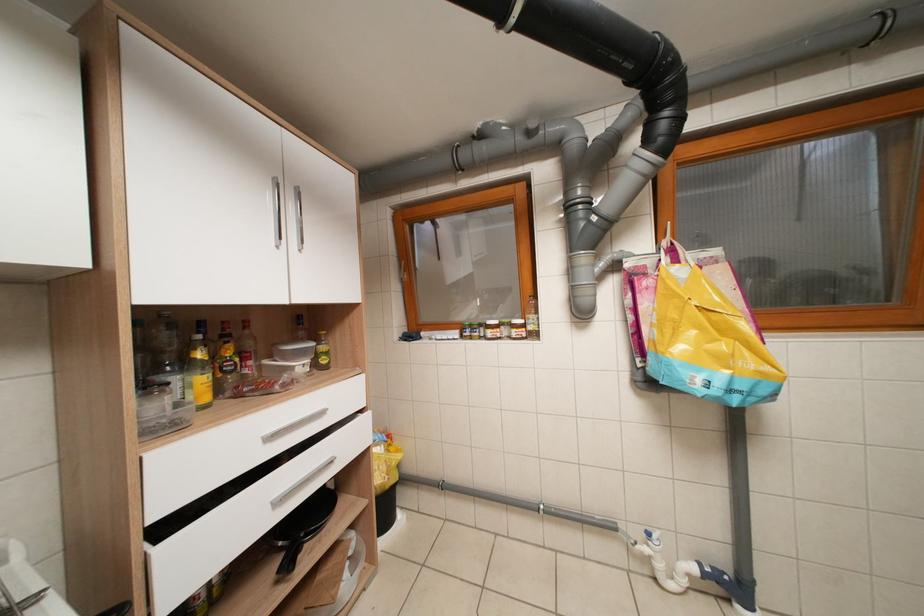
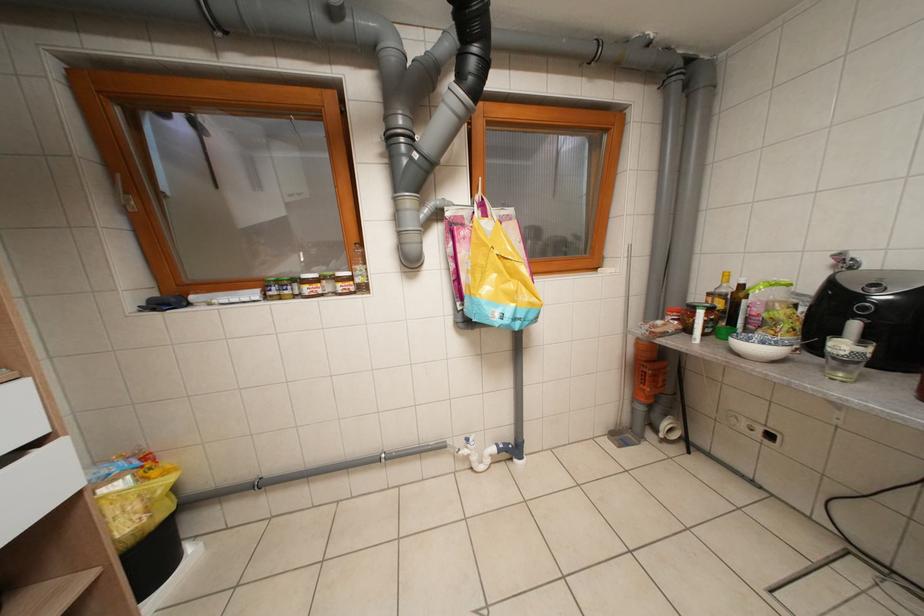
Question: The images are taken continuously from a first-person perspective. In which direction is your viewpoint rotating?

Choices:
 (A) Left
 (B) Right
 (C) Up
 (D) Down

Answer: (B)